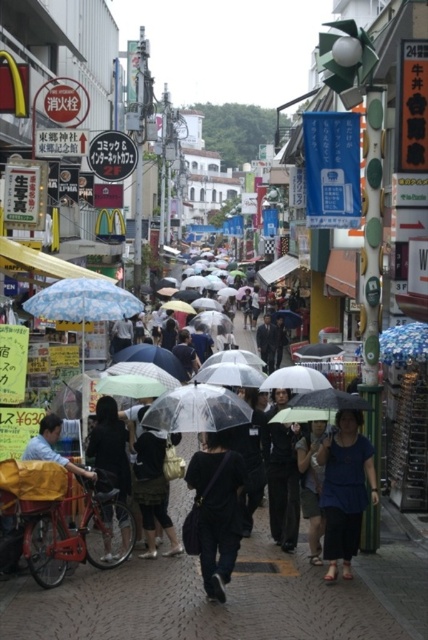
You are a delivery person who needs to carry both the black matte bag at center and the dark blue fabric shirt at center. Which item should you pick up first if you want to carry the larger item first?

The black matte bag at center is bigger than the dark blue fabric shirt at center, so you should pick up the black matte bag at center first.